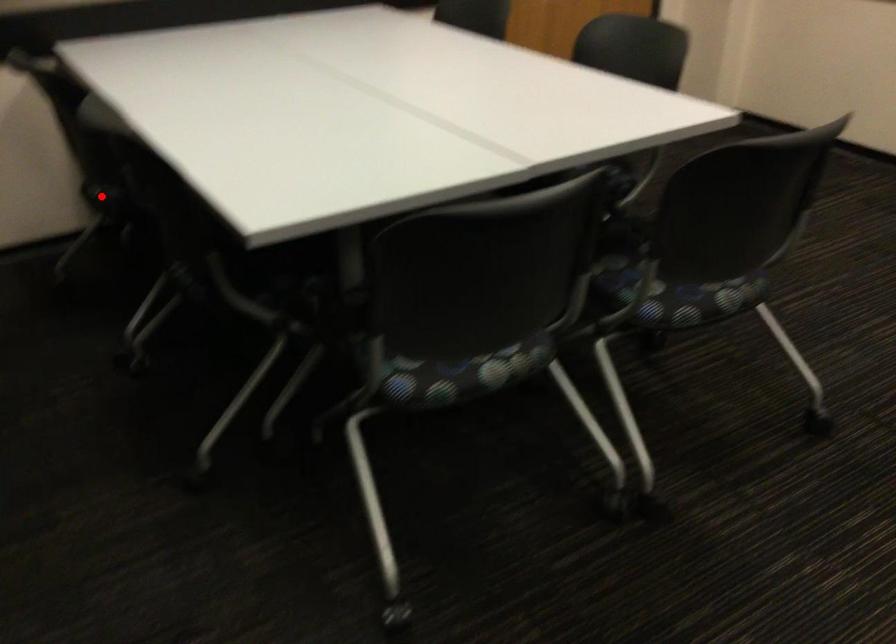
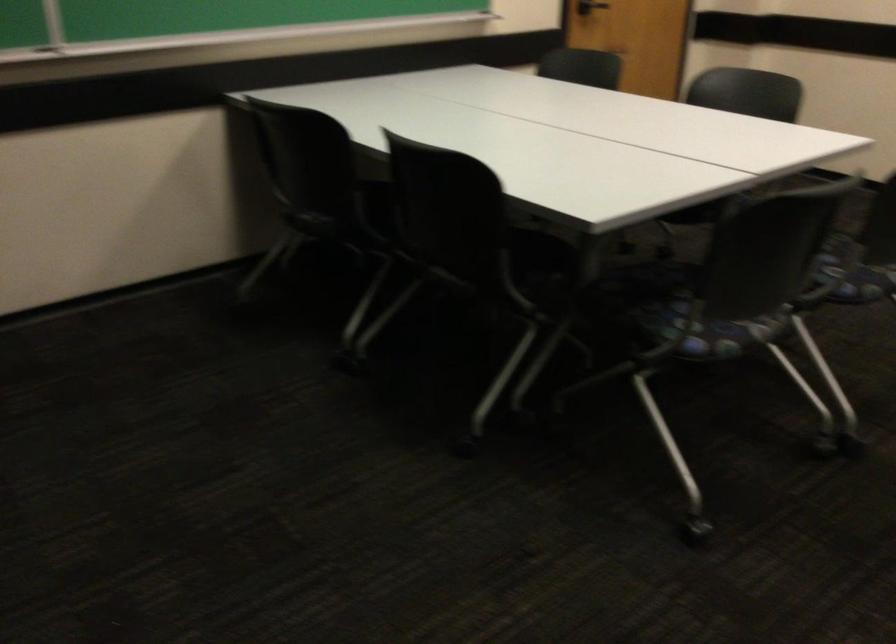
The point at the highlighted location is marked in the first image. Where is the corresponding point in the second image?

(320, 225)